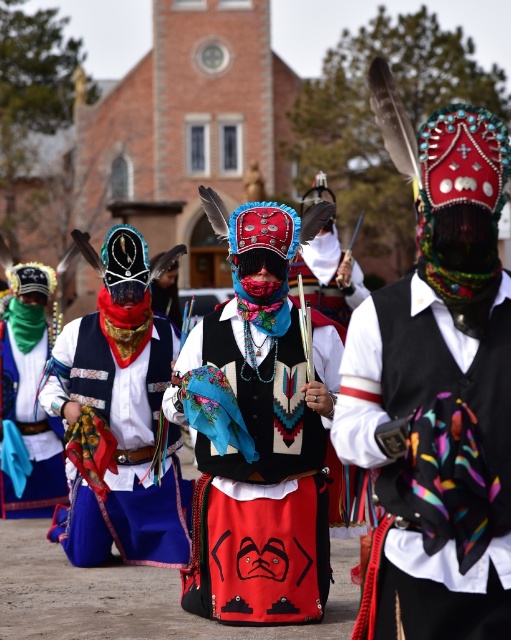
Consider the image. You are a photographer trying to capture both the embroidered fabric skirt at center and the green satin scarf at left in a single frame. Since you can only focus on one object at a time, which one should you choose to ensure it fills more of your camera view?

The embroidered fabric skirt at center is bigger than the green satin scarf at left, so you should focus on the embroidered fabric skirt at center to ensure it fills more of your camera view.

You are a photographer standing at the entrance of the brick building and want to capture the multicolored woven scarf at center in your photo. Based on its position, where should you aim your camera?

You should aim your camera at point 0.722 on the horizontal axis and 0.843 on the vertical axis to capture the multicolored woven scarf at center.

You are an observer at the event and need to locate the blue fabric skirt at center and the green satin scarf at left. Which one is positioned to the right of the other?

The blue fabric skirt at center is to the right of the green satin scarf at left.